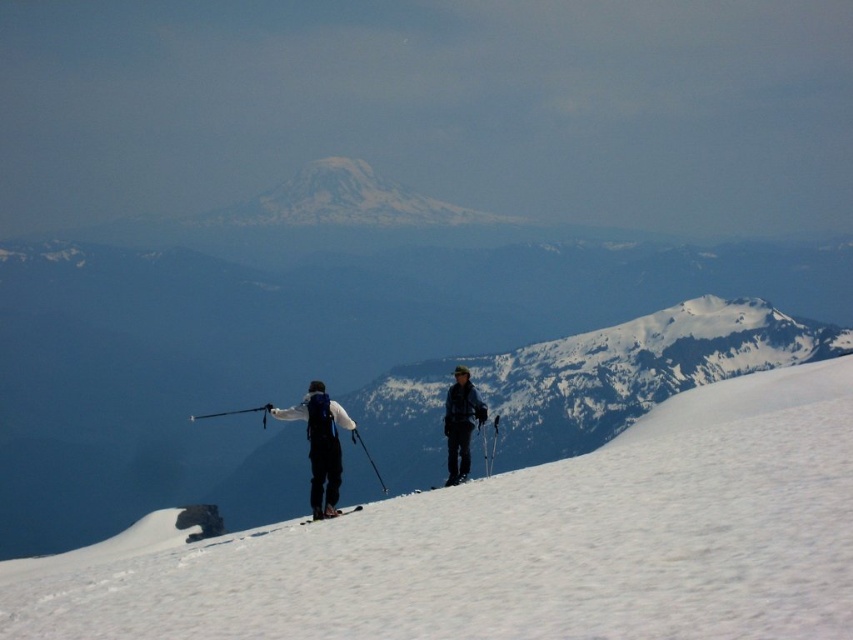
Question: Where is dark blue ski suit at center located in relation to black matte ski pole at center in the image?

Choices:
 (A) right
 (B) left

Answer: (A)

Question: Is dark blue ski suit at center thinner than black matte ski at lower center?

Choices:
 (A) yes
 (B) no

Answer: (A)

Question: Among these points, which one is nearest to the camera?

Choices:
 (A) (303, 522)
 (B) (320, 403)

Answer: (A)

Question: Which object is positioned farthest from the dark blue ski suit at center?

Choices:
 (A) matte black backpack at center
 (B) white snow at center
 (C) black matte ski pole at center

Answer: (C)

Question: Does matte black backpack at center have a larger size compared to black matte ski at lower center?

Choices:
 (A) yes
 (B) no

Answer: (A)

Question: Which point is closer to the camera?

Choices:
 (A) (345, 509)
 (B) (468, 449)
 (C) (331, 627)

Answer: (C)